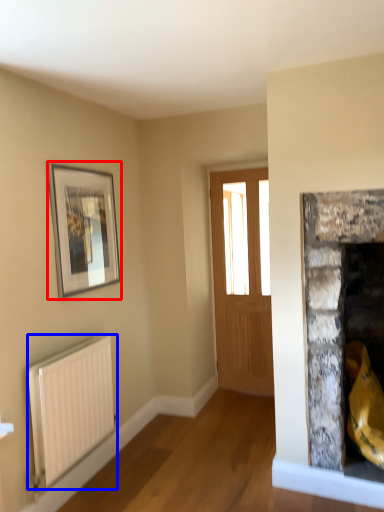
Question: Which point is further to the camera, picture frame (highlighted by a red box) or radiator (highlighted by a blue box)?

Choices:
 (A) picture frame
 (B) radiator

Answer: (A)